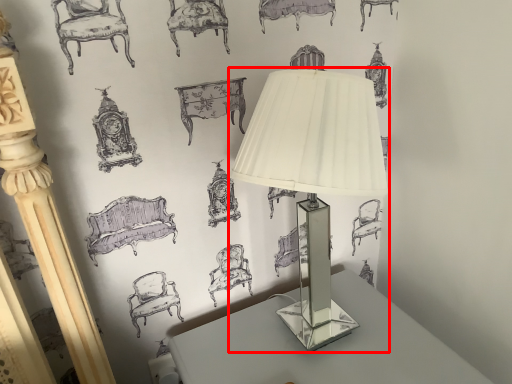
Question: Where is lamp (annotated by the red box) located in relation to table in the image?

Choices:
 (A) right
 (B) left

Answer: (B)